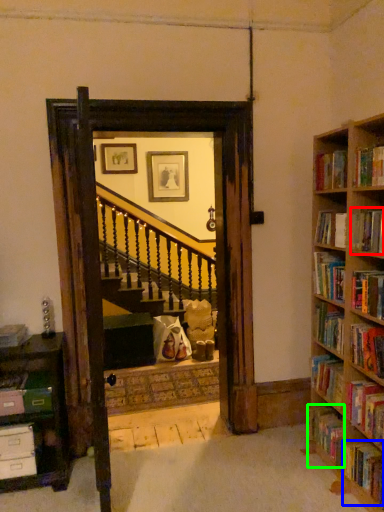
Question: Which object is the farthest from book (highlighted by a red box)? Choose among these: book (highlighted by a blue box) or book (highlighted by a green box).

Choices:
 (A) book
 (B) book

Answer: (B)